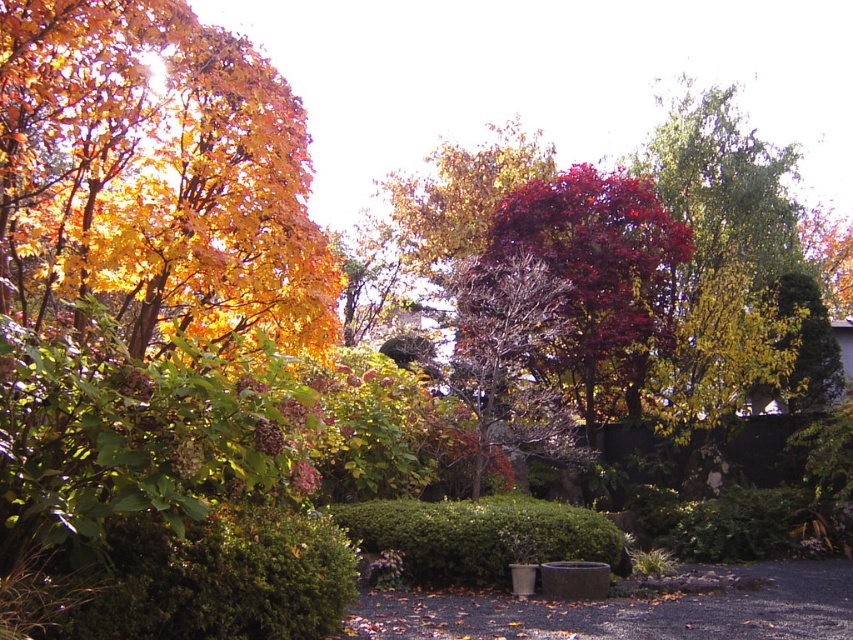
Question: Can you confirm if green textured hedge at lower left is thinner than green matte hedge at center?

Choices:
 (A) no
 (B) yes

Answer: (B)

Question: Which point is farther to the camera?

Choices:
 (A) (476, 577)
 (B) (335, 595)

Answer: (A)

Question: From the image, what is the correct spatial relationship of green textured hedge at lower left in relation to green matte hedge at center?

Choices:
 (A) above
 (B) below

Answer: (A)

Question: Does green textured hedge at lower left appear over green matte hedge at center?

Choices:
 (A) no
 (B) yes

Answer: (B)

Question: Which object appears farthest from the camera in this image?

Choices:
 (A) green textured hedge at lower left
 (B) green matte hedge at center

Answer: (B)